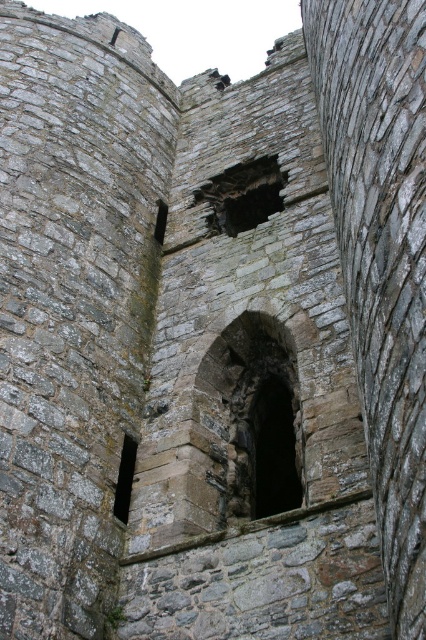
You are an architect examining the medieval stone structure. You notice the dark stone hole at center and the dark stone window at lower left. Which of these two features is located higher up in the image?

The dark stone hole at center is positioned over the dark stone window at lower left, meaning it is higher up.

Based on the photo, you are an architect examining the medieval stone structure. You need to determine which object occupies more space in the scene. Based on the rough stone archway at center and the dark stone window at lower left, which one is bigger?

The rough stone archway at center is larger in size compared to the dark stone window at lower left, so the rough stone archway at center occupies more space in the scene.

You are an architect examining the medieval stone structure. You notice the rough stone archway at center and the dark stone hole at center. Which object is positioned more to the east if the image is oriented with north at the top?

The rough stone archway at center is to the right of the dark stone hole at center. Since the image is oriented with north at the top, right would correspond to east. Therefore, the rough stone archway at center is positioned more to the east.